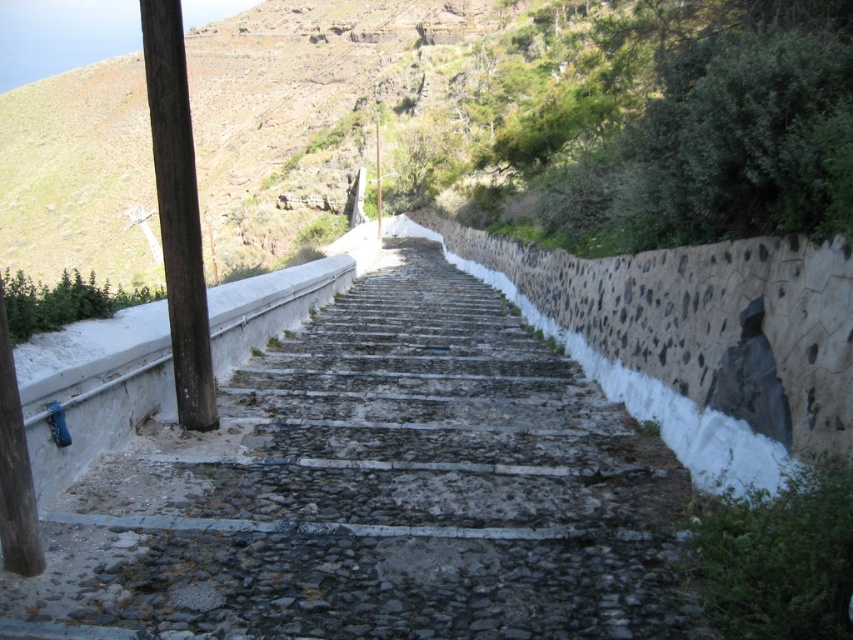
From the picture: You are a delivery person carrying a heavy package and need to climb the rough stone steps at center. There is a brown wood post at left nearby. To avoid hitting your head on the post, which direction should you lean while climbing the steps?

Since the rough stone steps at center are positioned under the brown wood post at left, you should lean to the right to avoid hitting your head on the post.

You are standing at the bottom of the narrow, stone staircase and want to reach the top. There are two points marked on the staircase. One is at coordinates point (344, 332) and the other is at point (173, 56). Which point is closer to you as you start climbing?

Point (173, 56) is closer to you because it is less further to the viewer than point (344, 332).